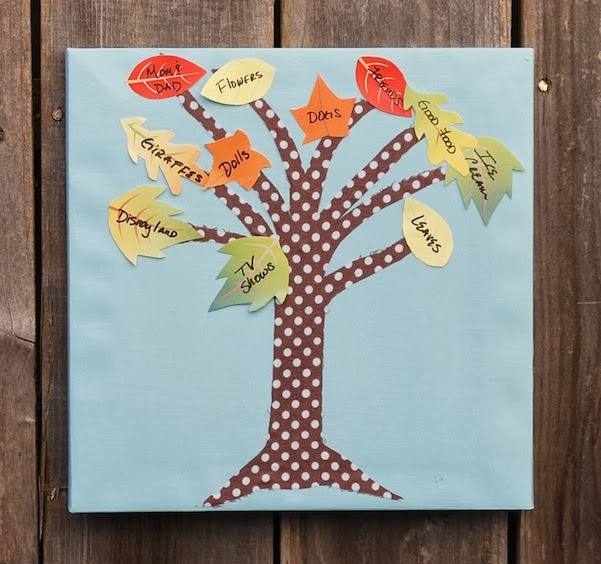
The image size is (601, 564). I want to click on light blue hanging square board, so click(x=407, y=362).